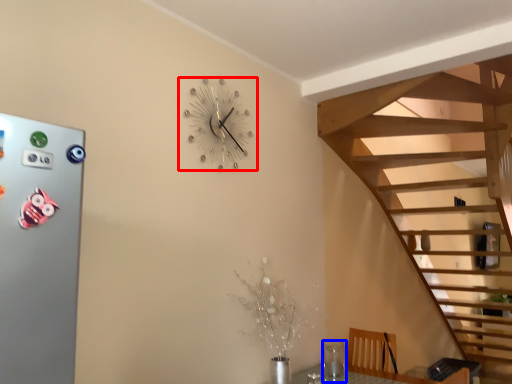
Question: Which object appears farthest to the camera in this image, wall clock (highlighted by a red box) or glass vase (highlighted by a blue box)?

Choices:
 (A) wall clock
 (B) glass vase

Answer: (B)